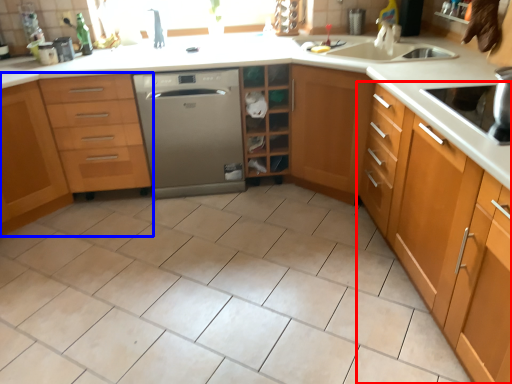
Question: Which of the following is the closest to the observer, cabinetry (highlighted by a red box) or cabinetry (highlighted by a blue box)?

Choices:
 (A) cabinetry
 (B) cabinetry

Answer: (A)